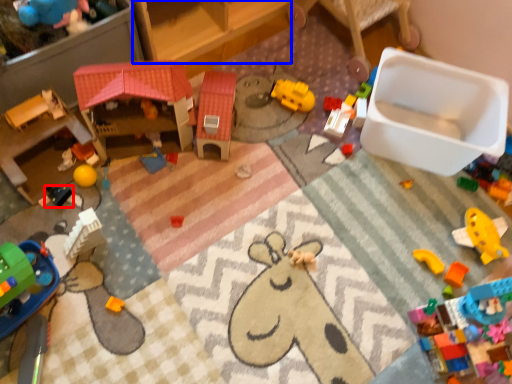
Question: Which point is further to the camera, toy (highlighted by a red box) or furniture (highlighted by a blue box)?

Choices:
 (A) toy
 (B) furniture

Answer: (A)